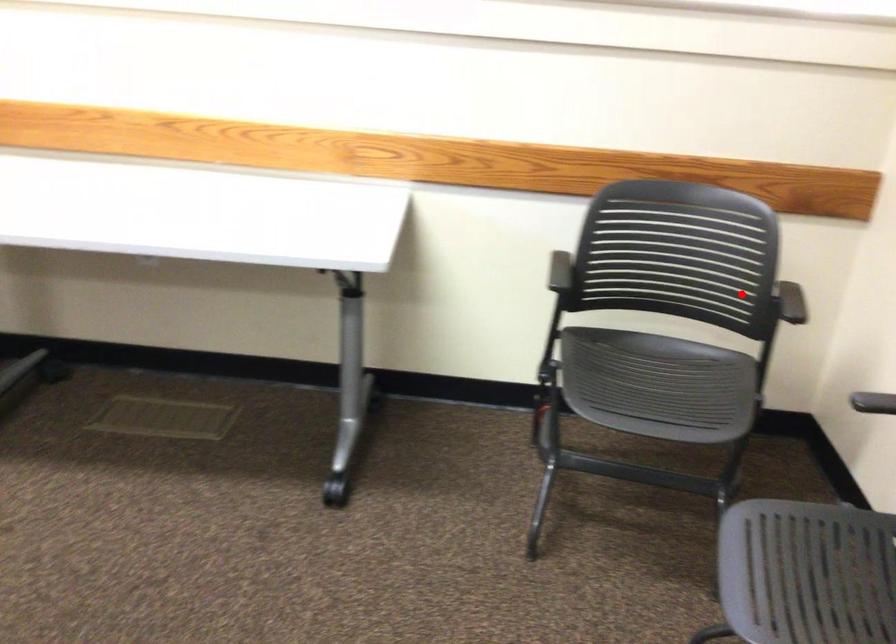
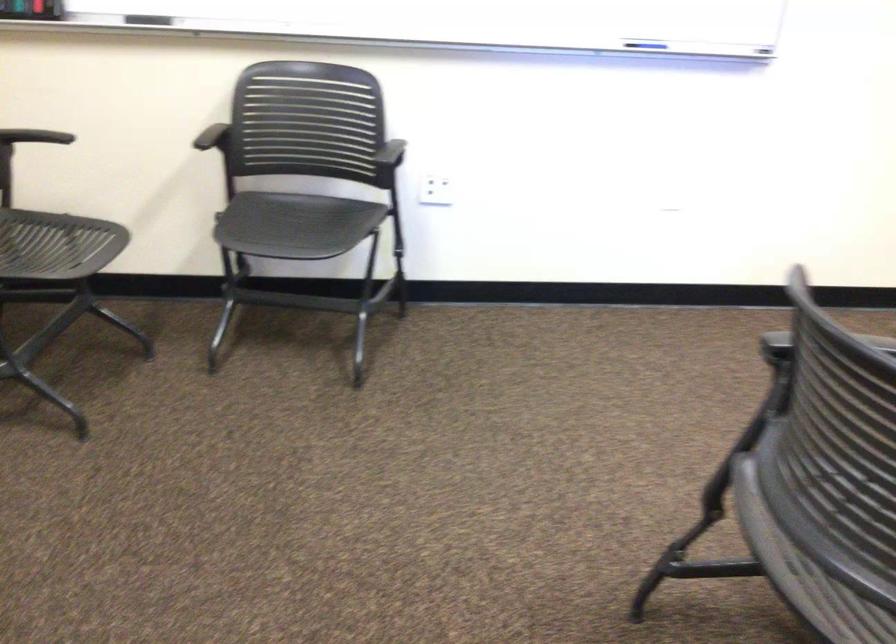
Question: I am providing you with two images of the same scene from different viewpoints. Image1 has a red point marked. In image2, the corresponding 3D location appears at what relative position? Reply with the corresponding letter.

Choices:
 (A) Closer
 (B) Farther

Answer: (B)